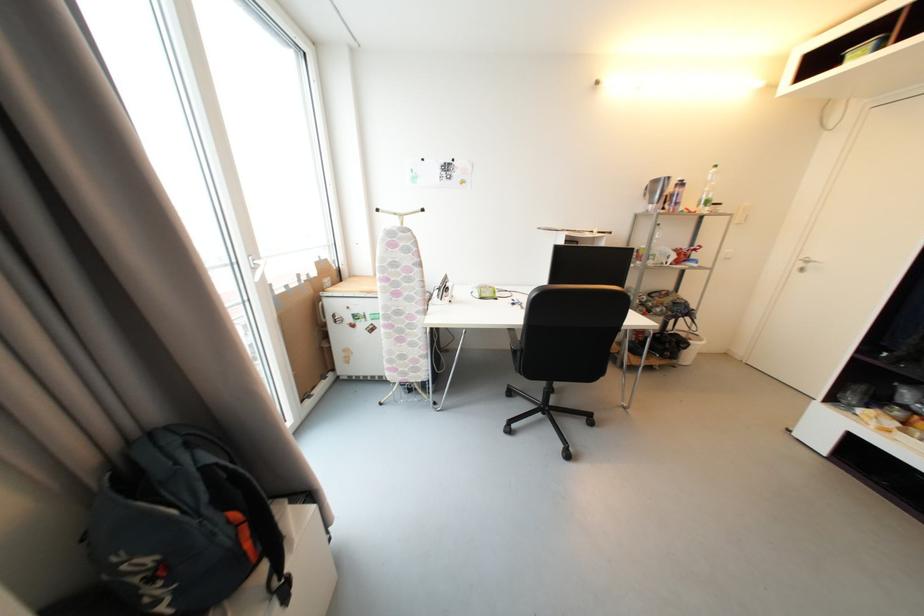
Locate an element on the screen. This screenshot has height=616, width=924. purple spray bottle is located at coordinates (676, 196).